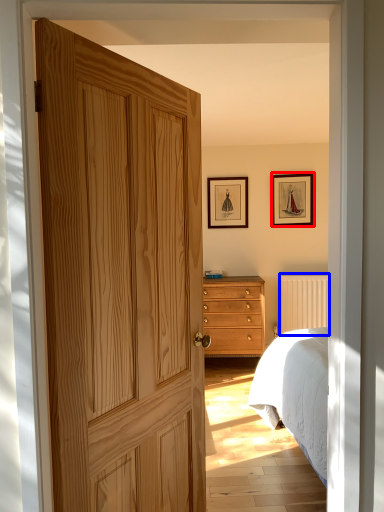
Question: Which point is closer to the camera, picture frame (highlighted by a red box) or radiator (highlighted by a blue box)?

Choices:
 (A) picture frame
 (B) radiator

Answer: (B)